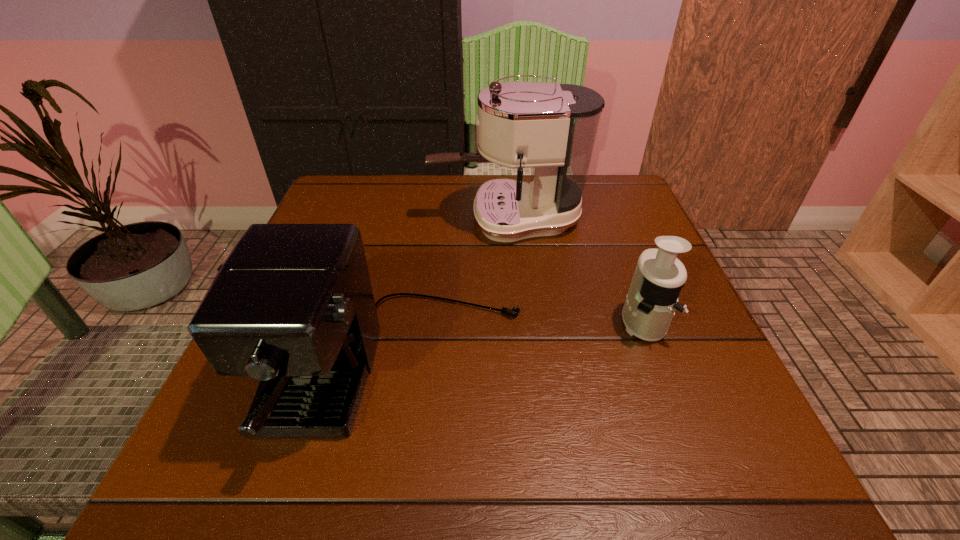
This screenshot has height=540, width=960. What are the coordinates of `object positioned at the far edge` in the screenshot? It's located at (551, 128).

Locate an element on the screen. The image size is (960, 540). object that is positioned at the near edge is located at coordinates (292, 306).

Locate an element on the screen. object present at the left edge is located at coordinates (292, 306).

Identify the location of coffee maker that is at the right edge. (551, 128).

In order to click on juicer that is at the right edge in this screenshot , I will do `click(650, 304)`.

Identify the location of object at the near left corner. The height and width of the screenshot is (540, 960). coord(292,306).

Locate an element on the screen. object that is at the far right corner is located at coordinates (551, 128).

Find the location of a particular element. Image resolution: width=960 pixels, height=540 pixels. free space at the far edge of the desktop is located at coordinates (452, 200).

The height and width of the screenshot is (540, 960). In order to click on vacant space at the near edge of the desktop in this screenshot , I will do `click(345, 472)`.

The height and width of the screenshot is (540, 960). I want to click on free location at the right edge, so click(x=645, y=355).